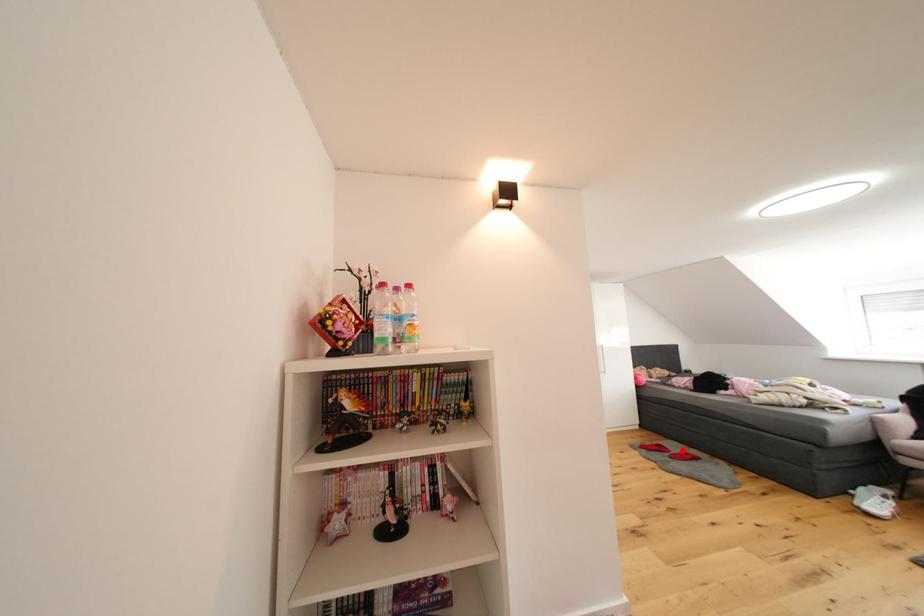
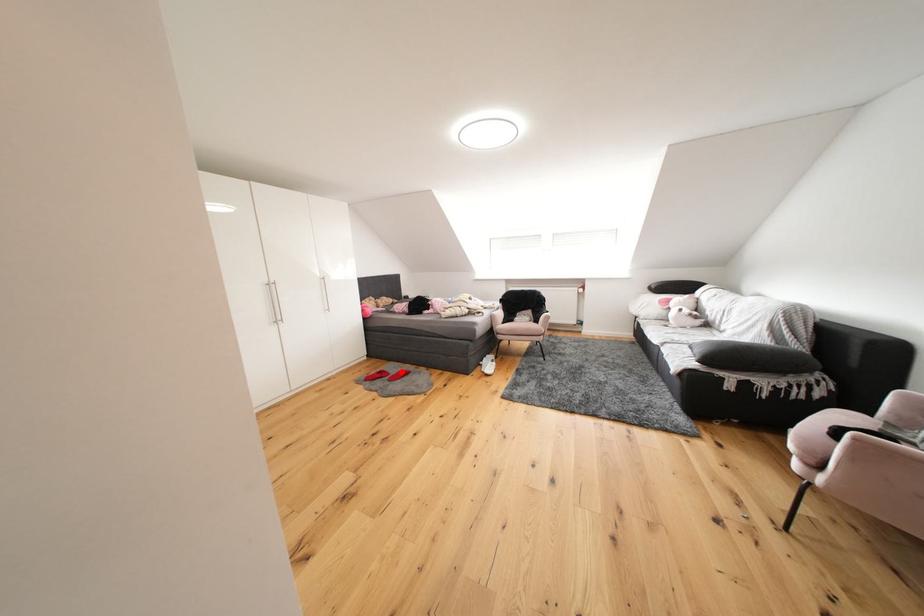
I am providing you with two images of the same scene from different viewpoints. A red point is marked on the first image and another point is marked on the second image. Is the red point in image1 aligned with the point shown in image2?

Yes